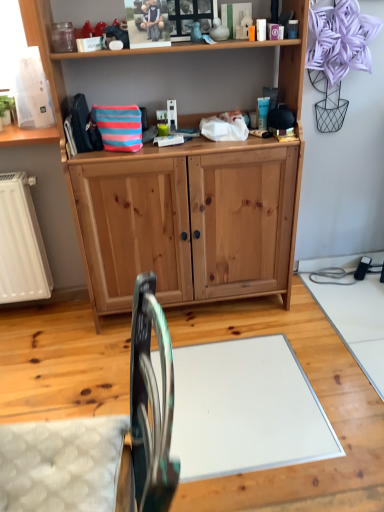
Find the location of a particular element. metallic teal swivel chair at lower left is located at coordinates (140, 395).

The image size is (384, 512). Describe the element at coordinates (140, 395) in the screenshot. I see `metallic teal swivel chair at lower left` at that location.

This screenshot has width=384, height=512. In order to click on natural wood cabinet at center in this screenshot , I will do `click(62, 131)`.

Describe the element at coordinates (62, 131) in the screenshot. The width and height of the screenshot is (384, 512). I see `natural wood cabinet at center` at that location.

Measure the distance between point (63,167) and camera.

Point (63,167) is 1.63 meters from camera.

Where is `metallic teal swivel chair at lower left`? metallic teal swivel chair at lower left is located at coordinates (140, 395).

Which object is positioned more to the right, metallic teal swivel chair at lower left or natural wood cabinet at center?

From the viewer's perspective, natural wood cabinet at center appears more on the right side.

Does metallic teal swivel chair at lower left lie behind natural wood cabinet at center?

No, it is in front of natural wood cabinet at center.

Between point (141, 382) and point (21, 7), which one is positioned behind?

The point (21, 7) is more distant.

From the image's perspective, between metallic teal swivel chair at lower left and natural wood cabinet at center, who is located below?

metallic teal swivel chair at lower left is shown below in the image.

From a real-world perspective, is metallic teal swivel chair at lower left physically below natural wood cabinet at center?

Yes, from a real-world perspective, metallic teal swivel chair at lower left is below natural wood cabinet at center.

Considering the relative sizes of metallic teal swivel chair at lower left and natural wood cabinet at center in the image provided, is metallic teal swivel chair at lower left wider than natural wood cabinet at center?

Indeed, metallic teal swivel chair at lower left has a greater width compared to natural wood cabinet at center.

In terms of height, does metallic teal swivel chair at lower left look taller or shorter compared to natural wood cabinet at center?

Considering their sizes, metallic teal swivel chair at lower left has less height than natural wood cabinet at center.

Between metallic teal swivel chair at lower left and natural wood cabinet at center, which one has smaller size?

metallic teal swivel chair at lower left is smaller.

Do you think metallic teal swivel chair at lower left is within natural wood cabinet at center, or outside of it?

metallic teal swivel chair at lower left is located beyond the bounds of natural wood cabinet at center.

Is metallic teal swivel chair at lower left positioned far away from natural wood cabinet at center?

No, there isn't a large distance between metallic teal swivel chair at lower left and natural wood cabinet at center.

Could you tell me if metallic teal swivel chair at lower left is facing natural wood cabinet at center?

No, metallic teal swivel chair at lower left is not oriented towards natural wood cabinet at center.

Find the location of a particular element. The height and width of the screenshot is (512, 384). vanity on the right of metallic teal swivel chair at lower left is located at coordinates (62, 131).

Can you confirm if natural wood cabinet at center is positioned to the left of metallic teal swivel chair at lower left?

Incorrect, natural wood cabinet at center is not on the left side of metallic teal swivel chair at lower left.

Considering their positions, is natural wood cabinet at center located in front of or behind metallic teal swivel chair at lower left?

Visually, natural wood cabinet at center is located behind metallic teal swivel chair at lower left.

Considering the positions of points (93, 303) and (139, 343), is point (93, 303) closer to camera compared to point (139, 343)?

No.

From the image's perspective, which one is positioned lower, natural wood cabinet at center or metallic teal swivel chair at lower left?

metallic teal swivel chair at lower left appears lower in the image.

From a real-world perspective, does natural wood cabinet at center sit lower than metallic teal swivel chair at lower left?

No, from a real-world perspective, natural wood cabinet at center is not beneath metallic teal swivel chair at lower left.

Considering the sizes of objects natural wood cabinet at center and metallic teal swivel chair at lower left in the image provided, who is thinner, natural wood cabinet at center or metallic teal swivel chair at lower left?

natural wood cabinet at center is thinner.

Who is shorter, natural wood cabinet at center or metallic teal swivel chair at lower left?

metallic teal swivel chair at lower left is shorter.

Considering the sizes of natural wood cabinet at center and metallic teal swivel chair at lower left in the image, is natural wood cabinet at center bigger or smaller than metallic teal swivel chair at lower left?

In the image, natural wood cabinet at center appears to be larger than metallic teal swivel chair at lower left.

Can we say natural wood cabinet at center lies outside metallic teal swivel chair at lower left?

Absolutely, natural wood cabinet at center is external to metallic teal swivel chair at lower left.

Would you say natural wood cabinet at center is a long distance from metallic teal swivel chair at lower left?

They are positioned close to each other.

Is natural wood cabinet at center facing away from metallic teal swivel chair at lower left?

No, metallic teal swivel chair at lower left is not at the back of natural wood cabinet at center.

How many degrees apart are the facing directions of natural wood cabinet at center and metallic teal swivel chair at lower left?

The angular difference between natural wood cabinet at center and metallic teal swivel chair at lower left is 90.3 degrees.

Where is `vanity that is above the metallic teal swivel chair at lower left (from a real-world perspective)`? This screenshot has height=512, width=384. vanity that is above the metallic teal swivel chair at lower left (from a real-world perspective) is located at coordinates (62, 131).

I want to click on vanity located above the metallic teal swivel chair at lower left (from the image's perspective), so pos(62,131).

Find the location of `swivel chair on the left side of natural wood cabinet at center`. swivel chair on the left side of natural wood cabinet at center is located at coordinates (140, 395).